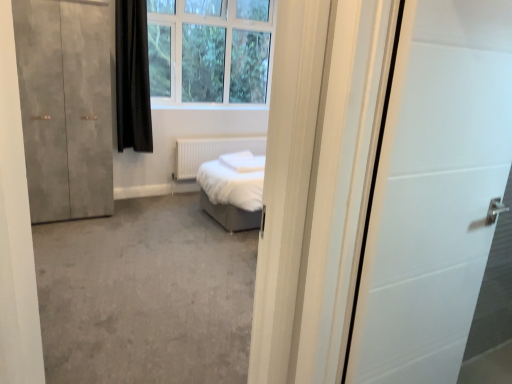
Question: Are white matte radiator at center and matte concrete wardrobe at left beside each other?

Choices:
 (A) yes
 (B) no

Answer: (B)

Question: Could matte concrete wardrobe at left be considered to be inside white matte radiator at center?

Choices:
 (A) yes
 (B) no

Answer: (B)

Question: Considering the relative sizes of white matte radiator at center and matte concrete wardrobe at left in the image provided, is white matte radiator at center smaller than matte concrete wardrobe at left?

Choices:
 (A) no
 (B) yes

Answer: (B)

Question: Is white matte radiator at center turned away from matte concrete wardrobe at left?

Choices:
 (A) no
 (B) yes

Answer: (A)

Question: Considering the relative sizes of white matte radiator at center and matte concrete wardrobe at left in the image provided, is white matte radiator at center taller than matte concrete wardrobe at left?

Choices:
 (A) yes
 (B) no

Answer: (B)

Question: In terms of size, does black matte curtain at upper left appear bigger or smaller than matte concrete wardrobe at left?

Choices:
 (A) small
 (B) big

Answer: (A)

Question: Considering the positions of point (133, 97) and point (82, 18), is point (133, 97) closer or farther from the camera than point (82, 18)?

Choices:
 (A) farther
 (B) closer

Answer: (A)

Question: Do you think black matte curtain at upper left is within matte concrete wardrobe at left, or outside of it?

Choices:
 (A) inside
 (B) outside

Answer: (B)

Question: In the image, is black matte curtain at upper left on the left side or the right side of matte concrete wardrobe at left?

Choices:
 (A) left
 (B) right

Answer: (B)

Question: Is matte concrete wardrobe at left in front of or behind black matte curtain at upper left in the image?

Choices:
 (A) behind
 (B) front

Answer: (B)

Question: Is point (51, 107) closer or farther from the camera than point (134, 28)?

Choices:
 (A) closer
 (B) farther

Answer: (A)

Question: From a real-world perspective, is matte concrete wardrobe at left above or below black matte curtain at upper left?

Choices:
 (A) above
 (B) below

Answer: (B)

Question: Is matte concrete wardrobe at left situated inside black matte curtain at upper left or outside?

Choices:
 (A) inside
 (B) outside

Answer: (B)

Question: Is white plastic window at upper center inside or outside of matte concrete wardrobe at left?

Choices:
 (A) outside
 (B) inside

Answer: (A)

Question: Looking at the image, does white plastic window at upper center seem bigger or smaller compared to matte concrete wardrobe at left?

Choices:
 (A) small
 (B) big

Answer: (B)